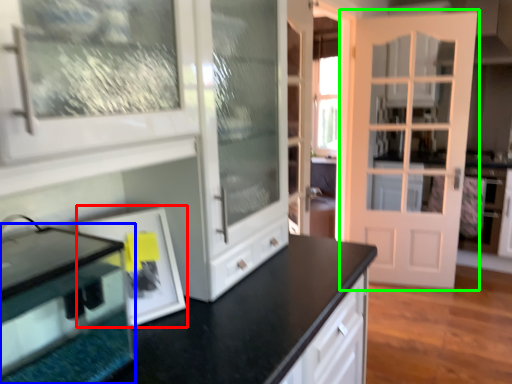
Question: Considering the real-world distances, which object is farthest from picture frame (highlighted by a red box)? appliance (highlighted by a blue box) or door (highlighted by a green box)?

Choices:
 (A) appliance
 (B) door

Answer: (B)